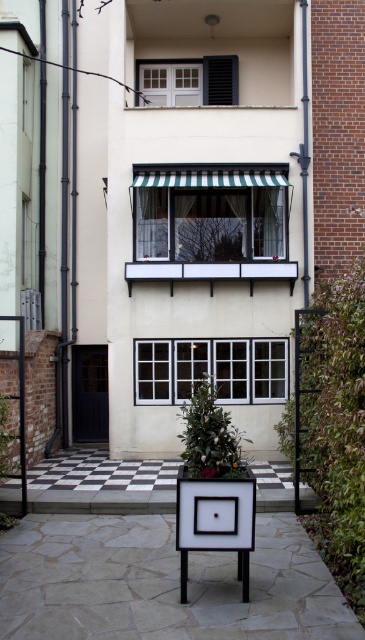
Looking at this image, you are a delivery person with a package that is 1.5 meters long. You need to pass between the white painted wood shed at center and the green striped awning at center. Is there enough space for your package to fit through the gap between them?

The gap between the white painted wood shed at center and the green striped awning at center is 1.22 meters. Since the package is 1.5 meters long, it is wider than the available space. Therefore, the package cannot fit through the gap between them.

From the picture: You are standing in front of the modern building and want to enter the black door. You notice a white painted wood shed at center and a green striped awning at center. Which object is closer to the black door?

The white painted wood shed at center is positioned on the right side of green striped awning at center. Since the shed is to the right of the awning, and the black door is at the ground level, the white painted wood shed at center is closer to the black door than the green striped awning at center.